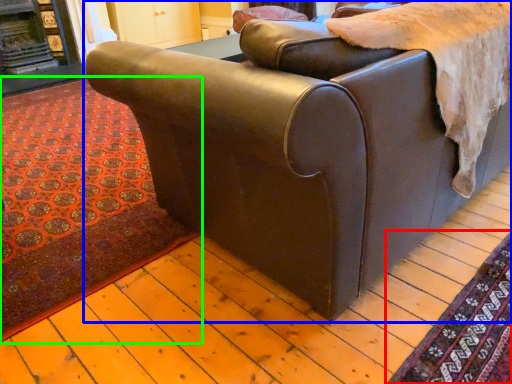
Question: Estimate the real-world distances between objects in this image. Which object is farther from mat (highlighted by a red box), studio couch (highlighted by a blue box) or mat (highlighted by a green box)?

Choices:
 (A) studio couch
 (B) mat

Answer: (B)